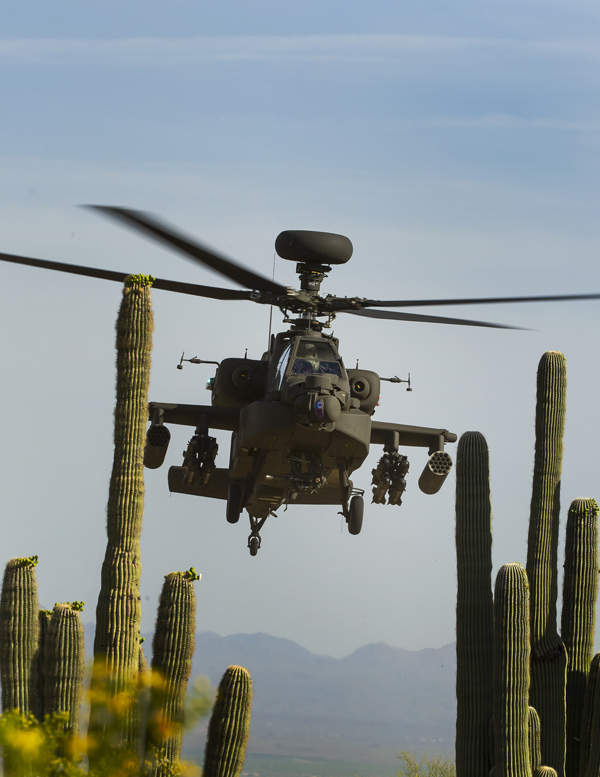
This screenshot has height=777, width=600. In order to click on windows in this screenshot , I will do `click(323, 375)`, `click(282, 364)`, `click(323, 350)`.